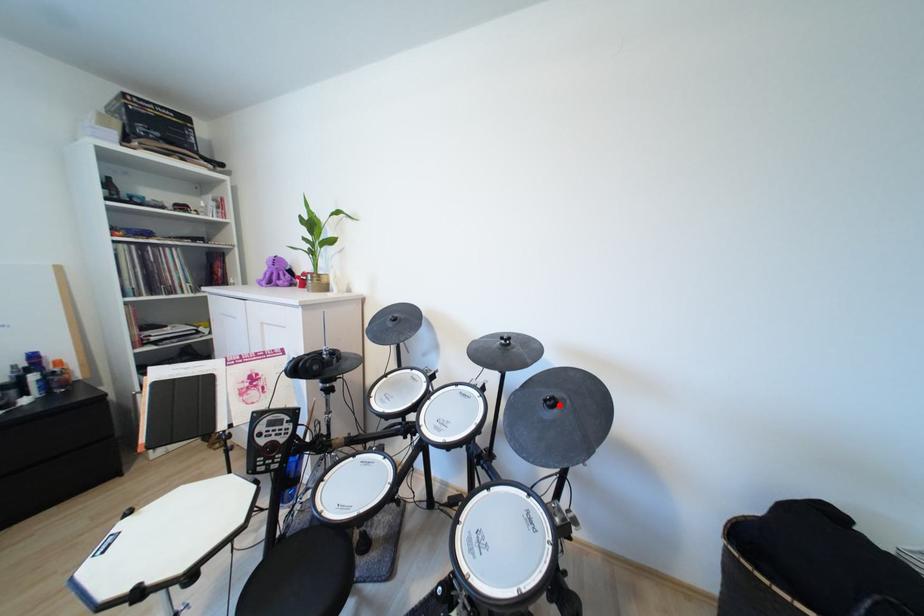
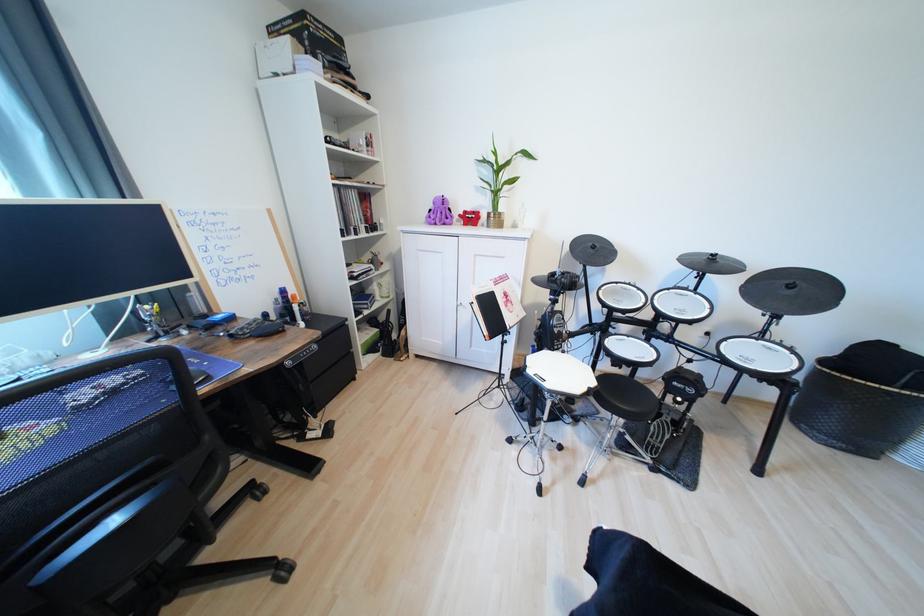
Where in the second image is the point corresponding to the highlighted location from the first image?

(797, 288)